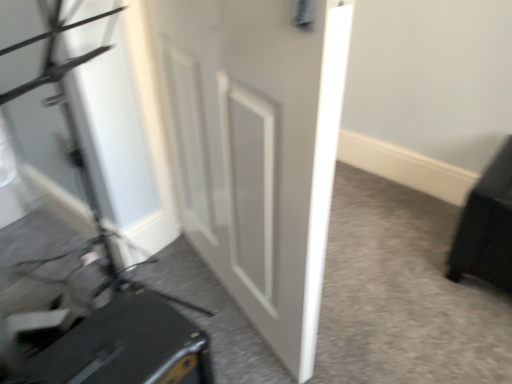
Question: Relative to matte black suitcase at lower left, is white matte door at center in front or behind?

Choices:
 (A) front
 (B) behind

Answer: (A)

Question: From a real-world perspective, is white matte door at center physically located above or below matte black suitcase at lower left?

Choices:
 (A) below
 (B) above

Answer: (B)

Question: Considering the real-world distances, which object is closest to the black matte suitcase at lower left?

Choices:
 (A) white matte door at center
 (B) matte black suitcase at lower left

Answer: (B)

Question: Which object is positioned farthest from the white matte door at center?

Choices:
 (A) matte black suitcase at lower left
 (B) black matte suitcase at lower left

Answer: (A)